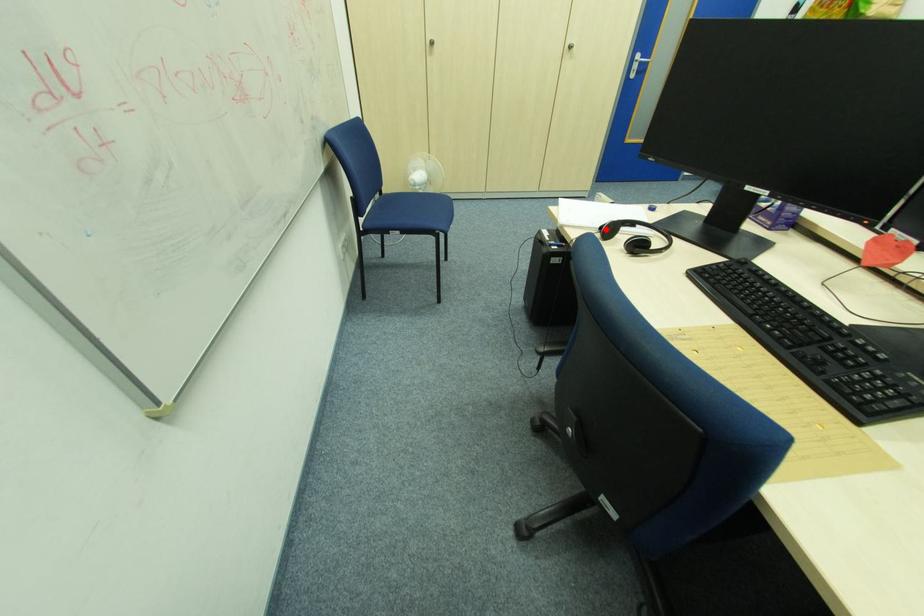
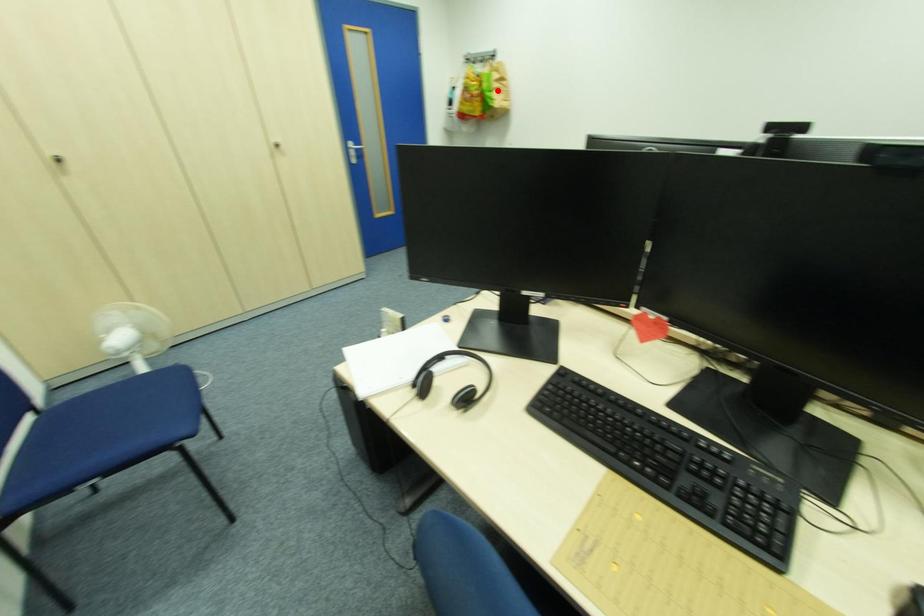
I am providing you with two images of the same scene from different viewpoints. A red point is marked on the first image and another point is marked on the second image. Does the point marked in image1 correspond to the same location as the one in image2?

No